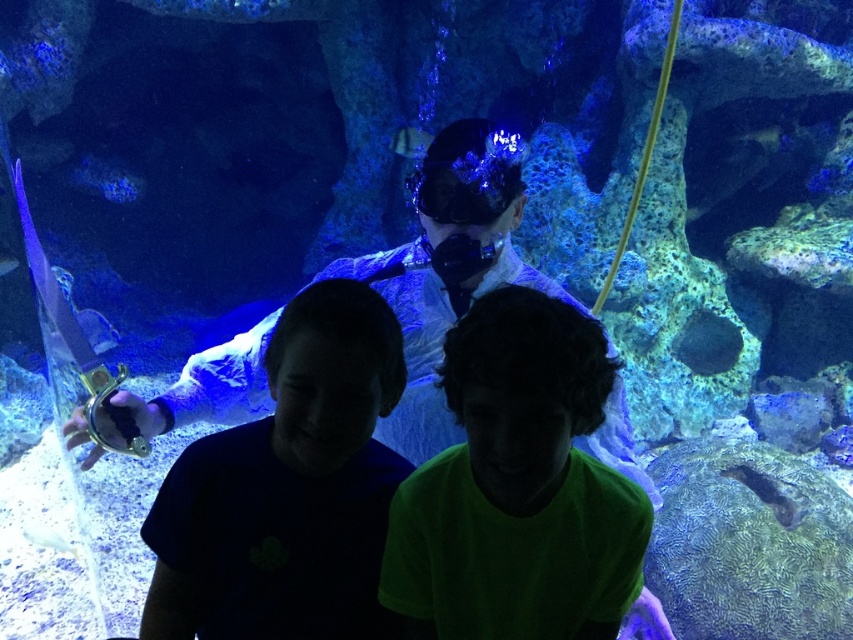
You are a tour guide leading a group near the aquarium exhibit. You want to ensure visitors can comfortably view both the green matte shirt at center and the white glossy fish at lower left without feeling cramped. Given that the average comfortable viewing distance for an adult is about 5 feet, is the current spacing between these two objects sufficient?

The distance between the green matte shirt at center and the white glossy fish at lower left is 6.82 feet, which exceeds the 5 feet comfortable viewing distance. Therefore, the spacing is sufficient for visitors to comfortably view both objects without feeling cramped.

You are standing in front of the aquarium exhibit with two people observing the underwater scene. There is a point marked at coordinates (517, 488). What object or person is located at that point?

The point at coordinates (517, 488) marks the green matte shirt at center.